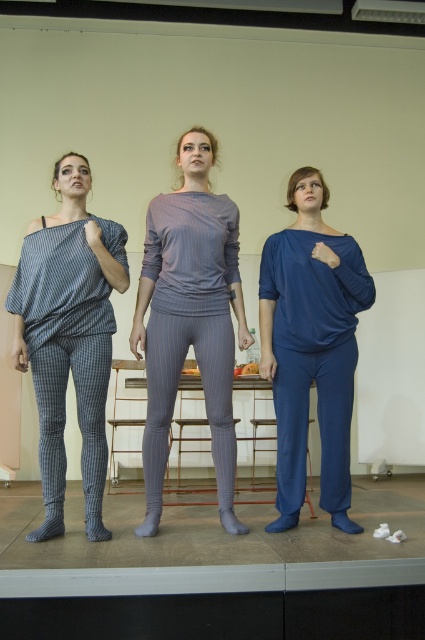
Question: Considering the real-world distances, which object is farthest from the striped fabric pants at left?

Choices:
 (A) pinstriped fabric pants at center
 (B) blue striped tights at left

Answer: (A)

Question: Does blue fabric stage at lower center have a larger size compared to pinstriped fabric pants at center?

Choices:
 (A) yes
 (B) no

Answer: (A)

Question: Is striped fabric pants at left above pinstriped fabric pants at center?

Choices:
 (A) yes
 (B) no

Answer: (B)

Question: Which object is positioned closest to the blue cotton pants at center?

Choices:
 (A) striped fabric pants at left
 (B) blue fabric stage at lower center
 (C) matte blue pants at center
 (D) blue striped tights at center

Answer: (C)

Question: Can you confirm if blue fabric stage at lower center is wider than pinstriped fabric pants at center?

Choices:
 (A) yes
 (B) no

Answer: (A)

Question: Considering the real-world distances, which object is closest to the blue striped tights at left?

Choices:
 (A) matte blue pants at center
 (B) blue fabric stage at lower center

Answer: (B)